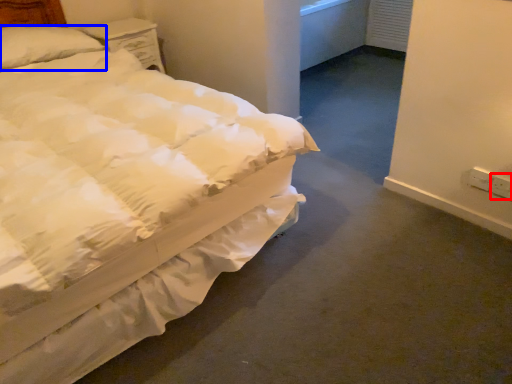
Question: Which object appears closest to the camera in this image, electric outlet (highlighted by a red box) or pillow (highlighted by a blue box)?

Choices:
 (A) electric outlet
 (B) pillow

Answer: (A)